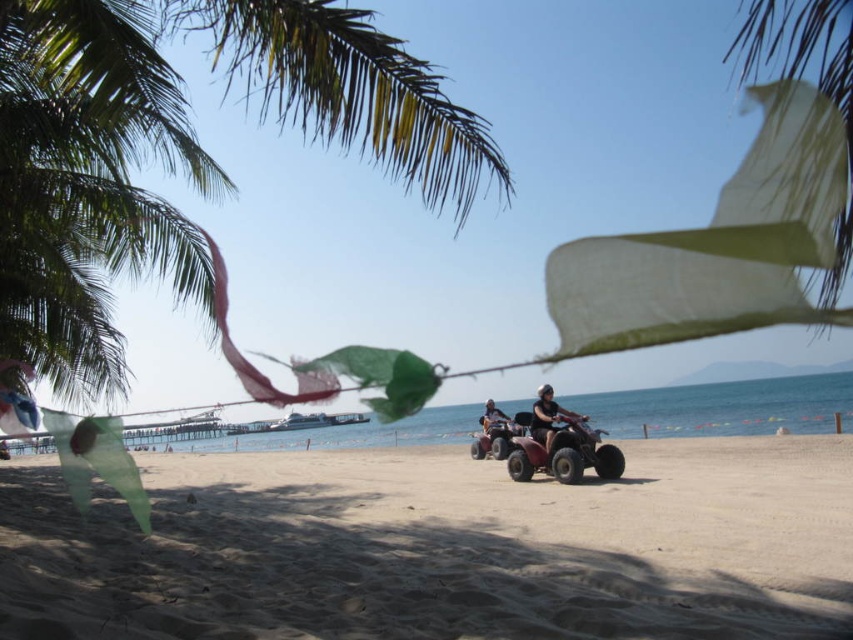
Question: Based on their relative distances, which object is nearer to the sandy beach at lower center?

Choices:
 (A) green leafy palm tree at upper left
 (B) matte black quad bike at center
 (C) metallic silver quad bike at center

Answer: (C)

Question: Considering the relative positions of metallic silver quad bike at center and matte black quad bike at center in the image provided, where is metallic silver quad bike at center located with respect to matte black quad bike at center?

Choices:
 (A) above
 (B) below

Answer: (A)

Question: Is sandy beach at lower center closer to camera compared to matte black quad bike at center?

Choices:
 (A) no
 (B) yes

Answer: (B)

Question: Among these objects, which one is nearest to the camera?

Choices:
 (A) green leafy palm tree at upper left
 (B) sandy beach at lower center

Answer: (B)

Question: Which object appears closest to the camera in this image?

Choices:
 (A) green leafy palm tree at upper left
 (B) matte black quad bike at center
 (C) sandy beach at lower center
 (D) metallic silver quad bike at center

Answer: (C)

Question: Can you confirm if sandy beach at lower center is thinner than metallic silver quad bike at center?

Choices:
 (A) no
 (B) yes

Answer: (A)